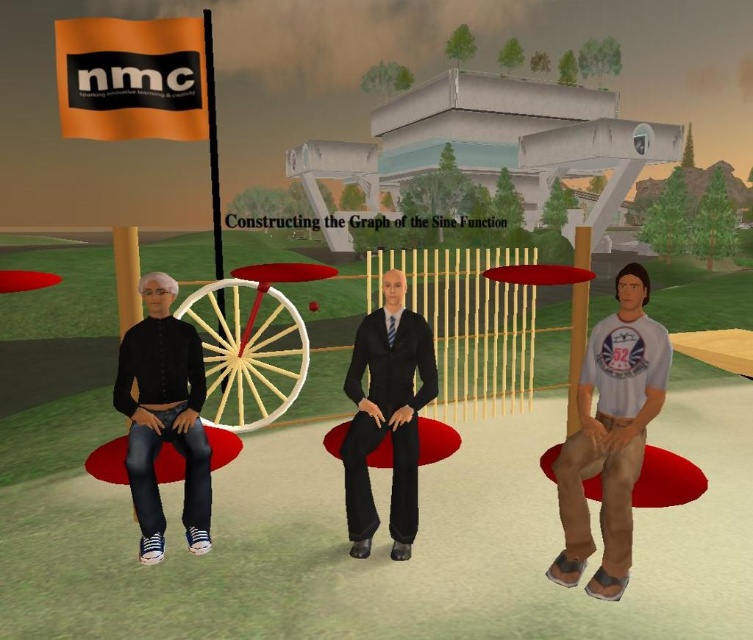
Does black matte jeans at left come behind matte black suit at center?

No, black matte jeans at left is closer to the viewer.

Who is positioned more to the left, black matte jeans at left or matte black suit at center?

From the viewer's perspective, black matte jeans at left appears more on the left side.

Is point (130, 365) positioned before point (404, 544)?

Yes, point (130, 365) is in front of point (404, 544).

You are a GUI agent. You are given a task and a screenshot of the screen. Output one action in this format:
    pyautogui.click(x=<x>, y=<y>)
    Task: Click on the black matte jeans at left
    The image size is (753, 640).
    Given the screenshot: What is the action you would take?
    pyautogui.click(x=163, y=416)

Consider the image. Is white cotton t-shirt at right positioned in front of matte black suit at center?

Yes, white cotton t-shirt at right is closer to the viewer.

Does point (569, 570) come in front of point (358, 449)?

Yes, it is.

Where is `white cotton t-shirt at right`? white cotton t-shirt at right is located at coordinates (610, 435).

Is white cotton t-shirt at right bigger than black matte jeans at left?

No.

Is white cotton t-shirt at right further to the viewer compared to black matte jeans at left?

No.

Which is in front, point (663, 349) or point (166, 387)?

Point (663, 349) is in front.

What are the coordinates of `white cotton t-shirt at right` in the screenshot? It's located at (610, 435).